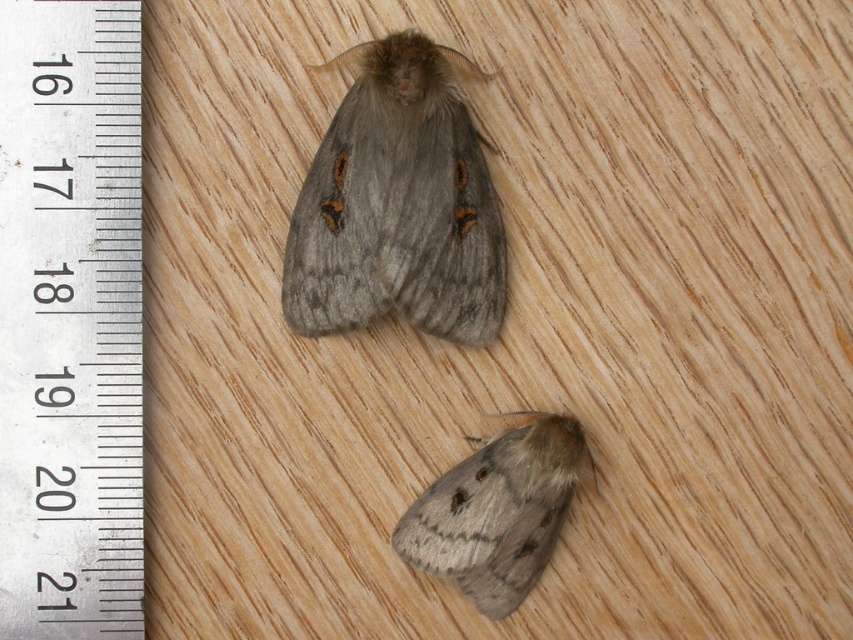
Looking at this image, does metallic silver ruler at upper left have a greater width compared to fuzzy gray moth at upper center?

Incorrect, metallic silver ruler at upper left's width does not surpass fuzzy gray moth at upper center's.

Which is more to the left, metallic silver ruler at upper left or fuzzy gray moth at upper center?

From the viewer's perspective, metallic silver ruler at upper left appears more on the left side.

Where is `metallic silver ruler at upper left`? The height and width of the screenshot is (640, 853). metallic silver ruler at upper left is located at coordinates (70, 321).

You are a GUI agent. You are given a task and a screenshot of the screen. Output one action in this format:
    pyautogui.click(x=<x>, y=<y>)
    Task: Click on the metallic silver ruler at upper left
    The image size is (853, 640).
    Given the screenshot: What is the action you would take?
    [70, 321]

Is metallic silver ruler at upper left taller than fuzzy gray moth at lower center?

Yes, metallic silver ruler at upper left is taller than fuzzy gray moth at lower center.

Is metallic silver ruler at upper left smaller than fuzzy gray moth at lower center?

Actually, metallic silver ruler at upper left might be larger than fuzzy gray moth at lower center.

The height and width of the screenshot is (640, 853). Find the location of `metallic silver ruler at upper left`. metallic silver ruler at upper left is located at coordinates (70, 321).

Is fuzzy gray moth at upper center below fuzzy gray moth at lower center?

Incorrect, fuzzy gray moth at upper center is not positioned below fuzzy gray moth at lower center.

What do you see at coordinates (398, 205) in the screenshot? I see `fuzzy gray moth at upper center` at bounding box center [398, 205].

Image resolution: width=853 pixels, height=640 pixels. What are the coordinates of `fuzzy gray moth at upper center` in the screenshot? It's located at (398, 205).